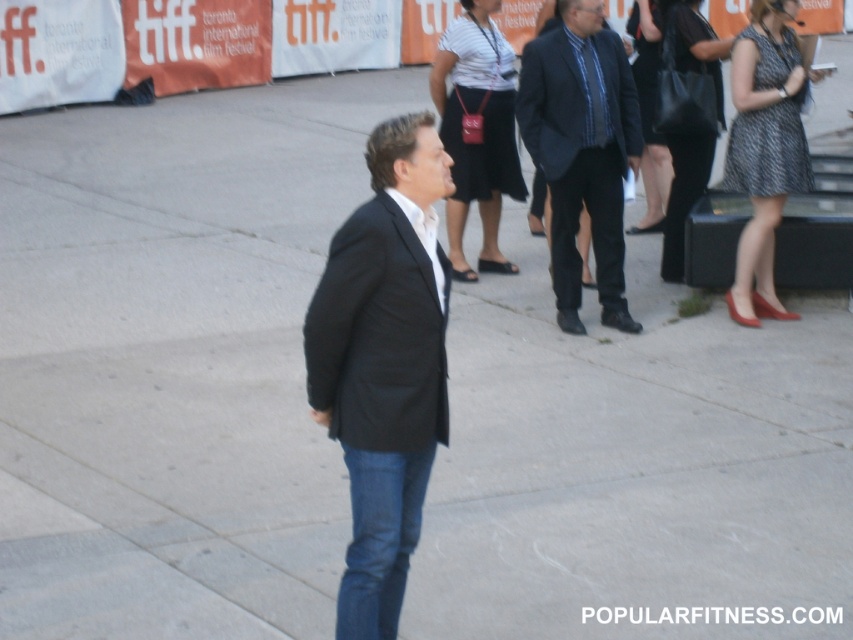
You are at the TIFF festival and see the white striped shirt at center and the black leather handbag at upper right. Which object is closer to you?

The white striped shirt at center is closer to you because the black leather handbag at upper right is behind it.

You are attending the TIFF festival and notice two items in the crowd. One is a white striped shirt at center and the other is a black leather handbag at upper right. From your vantage point, which item is positioned higher in the image?

The white striped shirt at center is located above the black leather handbag at upper right, so the white striped shirt at center is positioned higher in the image.